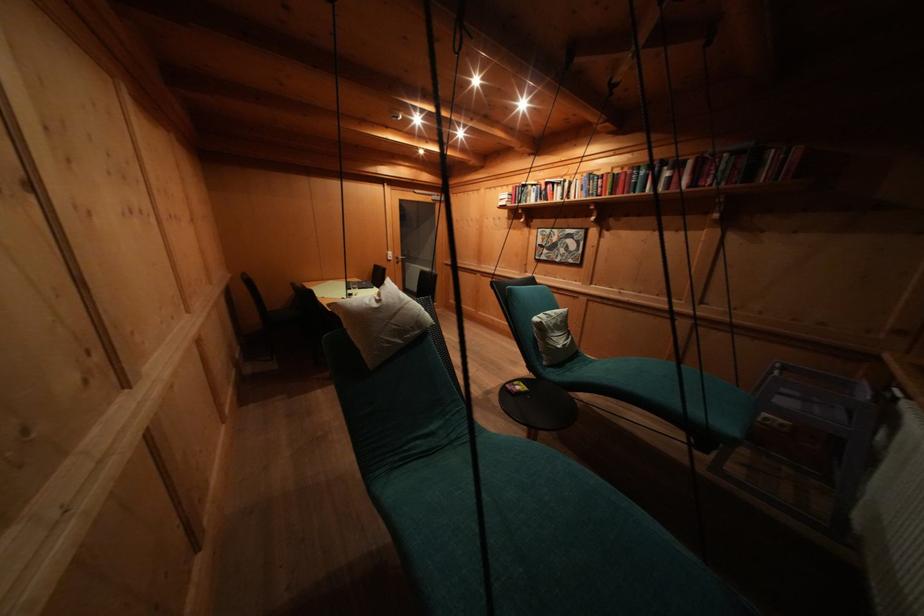
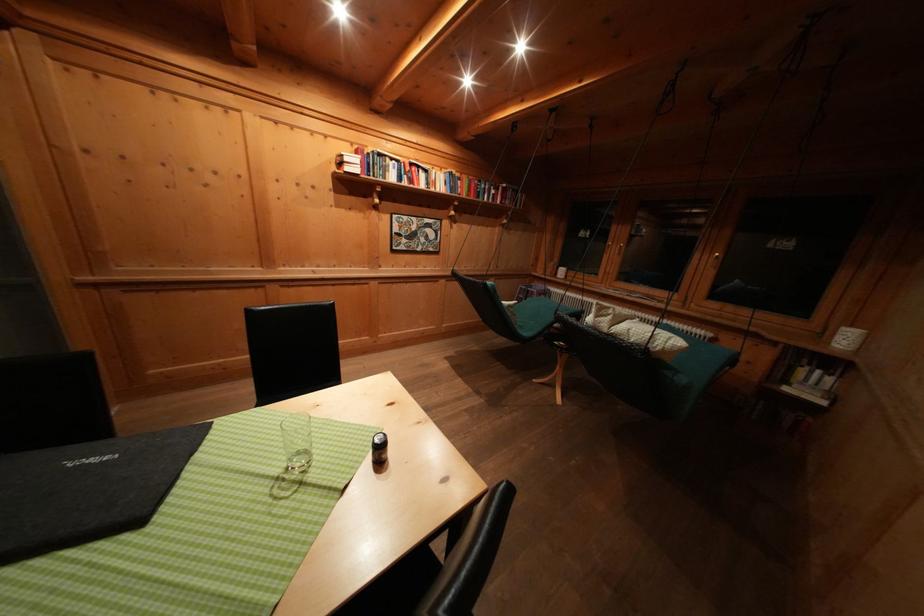
Find the pixel in the second image that matches [553,188] in the first image.

(418, 169)